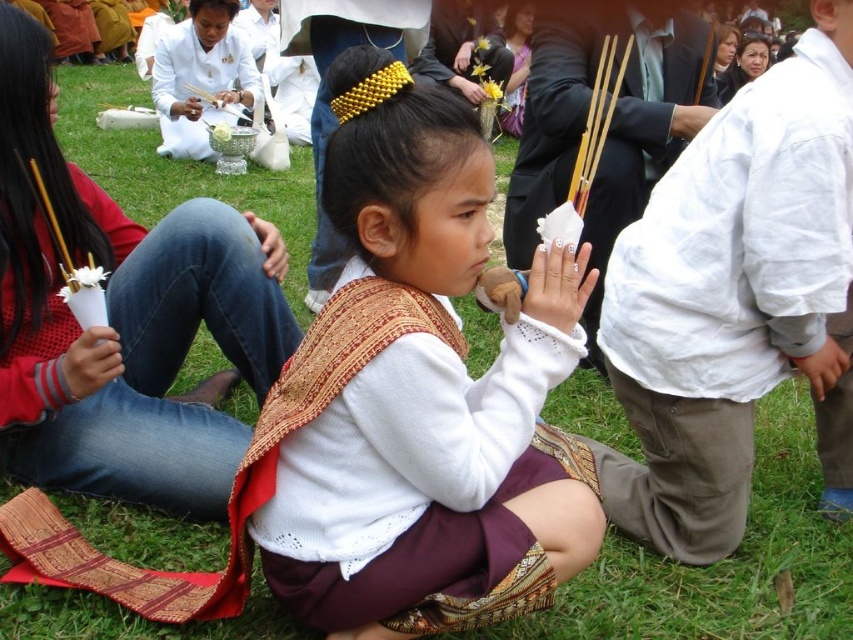
Question: Observing the image, what is the correct spatial positioning of white cotton shirt at right in reference to white fabric at lower left?

Choices:
 (A) left
 (B) right

Answer: (B)

Question: Which point appears closest to the camera in this image?

Choices:
 (A) (x=83, y=380)
 (B) (x=218, y=93)
 (C) (x=672, y=132)
 (D) (x=218, y=132)

Answer: (A)

Question: Which object appears farthest from the camera in this image?

Choices:
 (A) matte white sweater at center
 (B) white fabric hand at upper right
 (C) white lace hand at center

Answer: (C)

Question: Is white cotton shirt at right to the right of white fabric hand at upper right from the viewer's perspective?

Choices:
 (A) no
 (B) yes

Answer: (A)

Question: Which point is farther to the camera?

Choices:
 (A) white fabric hand at upper right
 (B) matte white sweater at center
 (C) matte silver bowl at upper center

Answer: (C)

Question: Where is white matte hand at center located in relation to shiny silver bowl at center in the image?

Choices:
 (A) right
 (B) left

Answer: (B)